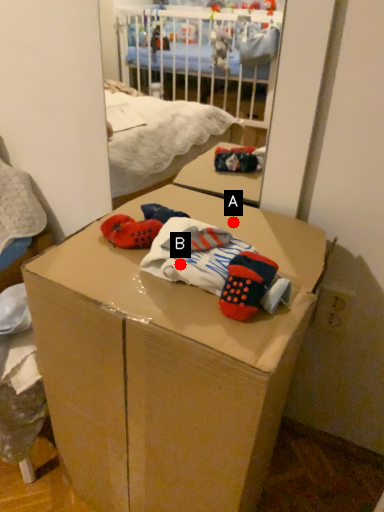
Question: Two points are circled on the image, labeled by A and B beside each circle. Which point is closer to the camera?

Choices:
 (A) A is closer
 (B) B is closer

Answer: (B)